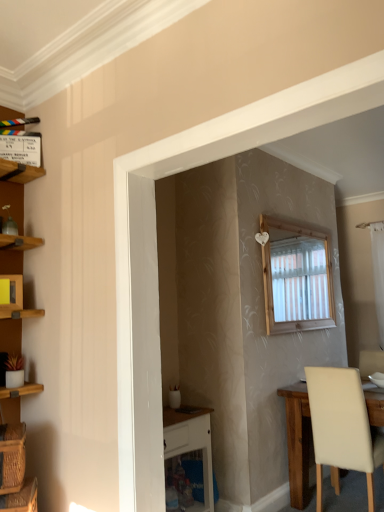
Question: In terms of width, does white sheer curtain at right look wider or thinner when compared to woven brown basket at lower left, acting as the 2th basket starting from the bottom?

Choices:
 (A) wide
 (B) thin

Answer: (B)

Question: In the image, is white sheer curtain at right on the left side or the right side of woven brown basket at lower left, acting as the 2th basket starting from the bottom?

Choices:
 (A) right
 (B) left

Answer: (A)

Question: Estimate the real-world distances between objects in this image. Which object is closer to the wooden clapperboard at upper left, the 1th cabinet viewed from the back?

Choices:
 (A) white glossy vanity at lower center
 (B) yellow matte cabinet at upper left, arranged as the second cabinet when viewed from the back
 (C) white sheer curtain at right
 (D) beige leather chair at lower right
 (E) woven brown basket at lower left, the 1th basket in the top-to-bottom sequence

Answer: (B)

Question: Based on their relative distances, which object is farther from the beige leather chair at lower right?

Choices:
 (A) woven brown basket at lower left, the second basket positioned from the top
 (B) woven brown basket at lower left, the 1th basket in the top-to-bottom sequence
 (C) yellow matte cabinet at upper left, arranged as the second cabinet when viewed from the back
 (D) white glossy vanity at lower center
 (E) wooden clapperboard at upper left, which ranks as the 2th cabinet in bottom-to-top order

Answer: (E)